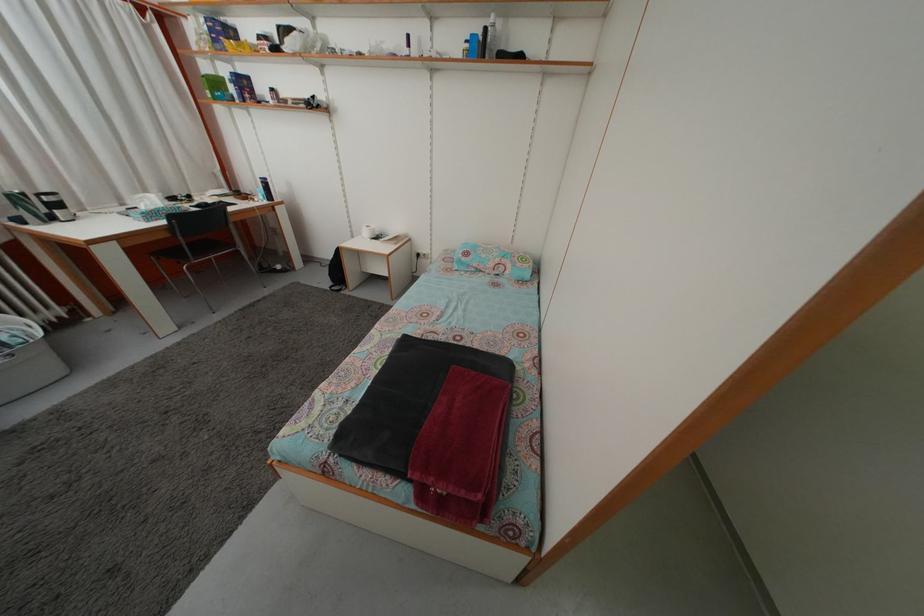
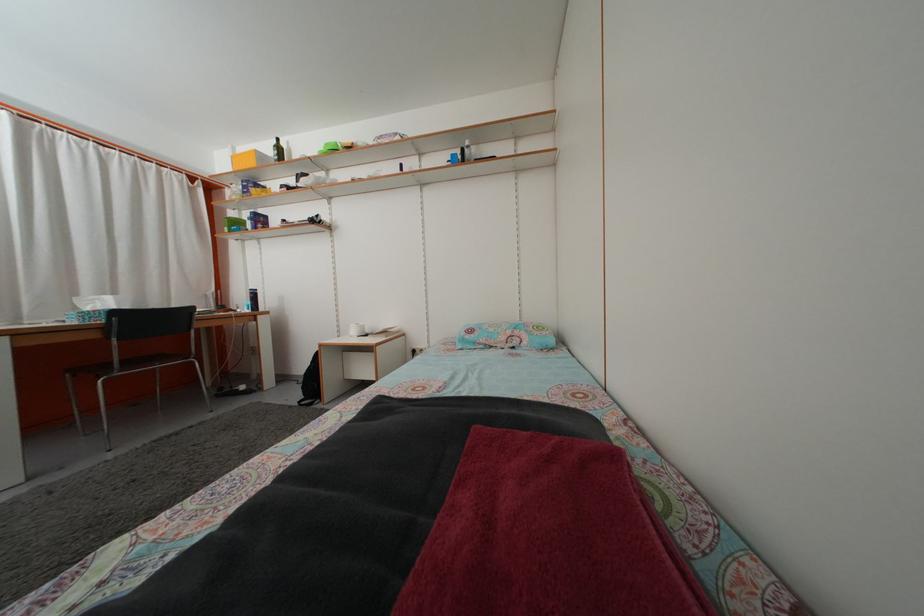
Find the pixel in the second image that matches point (497, 273) in the first image.

(508, 346)